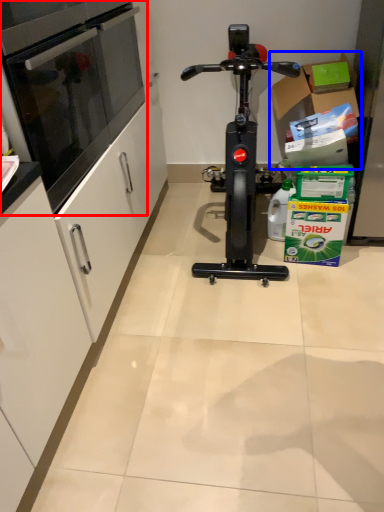
Question: Which object appears farthest to the camera in this image, oven (highlighted by a red box) or cardboard box (highlighted by a blue box)?

Choices:
 (A) oven
 (B) cardboard box

Answer: (B)